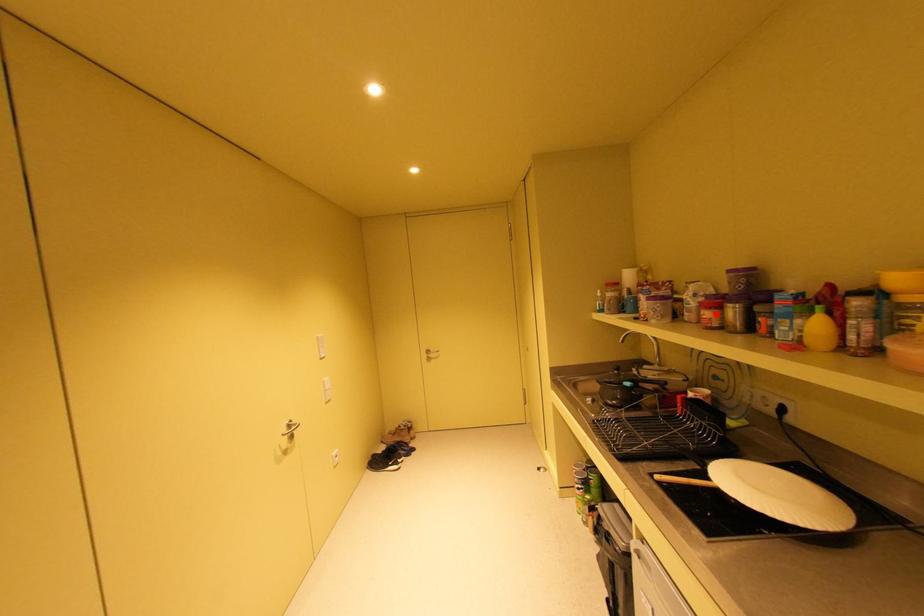
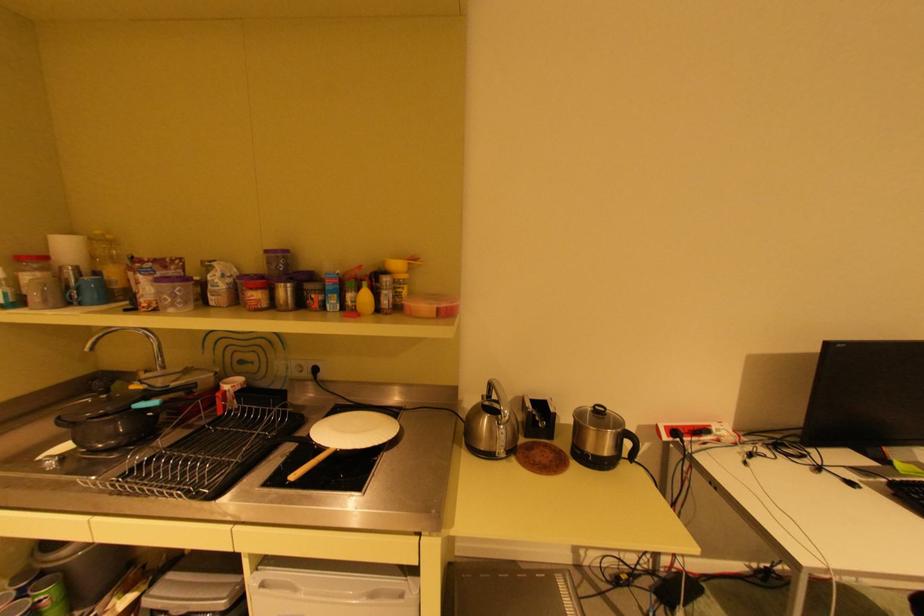
Find the pixel in the second image that matches the highlighted location in the first image.

(264, 294)